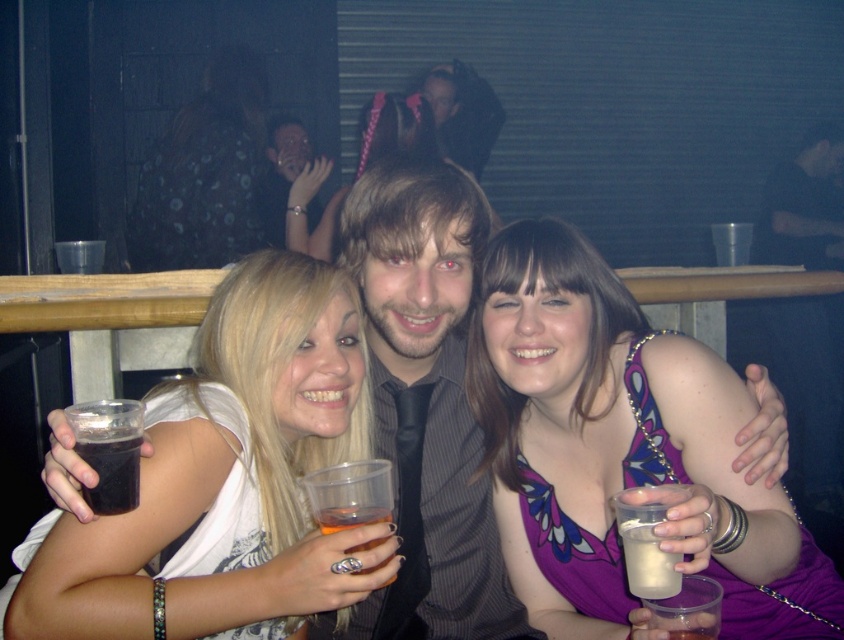
You are a photographer at the event and want to capture the purple floral dress at center and the translucent plastic cup at center in a single shot. Based on their positions, which object should you focus on first to ensure both are in frame?

The purple floral dress at center is above the translucent plastic cup at center, so focusing on the dress first will ensure the cup is also in frame below it.

You are standing at the camera position and want to throw a small object to the point marked as point (633, 417). Can you estimate how far you need to throw it?

The point (633, 417) is 4.58 feet away from the camera, so you need to throw the object approximately 4.58 feet to reach it.